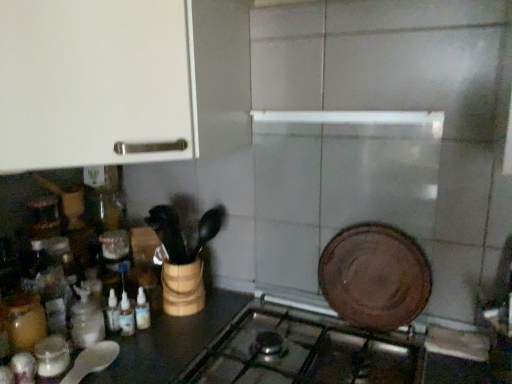
Where is `free spot in front of brown matte plate at upper right`? This screenshot has width=512, height=384. free spot in front of brown matte plate at upper right is located at coordinates (383, 350).